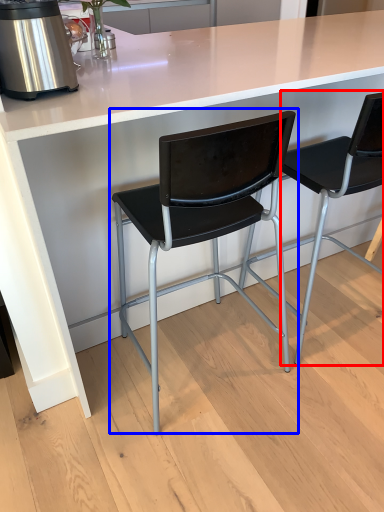
Question: Among these objects, which one is farthest to the camera, chair (highlighted by a red box) or chair (highlighted by a blue box)?

Choices:
 (A) chair
 (B) chair

Answer: (A)